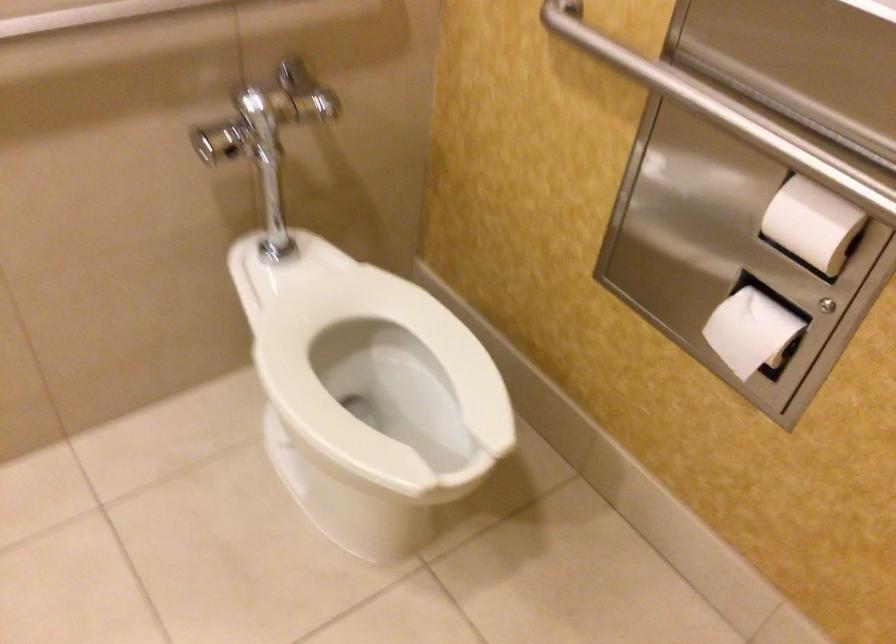
Question: The images are taken continuously from a first-person perspective. In which direction is your viewpoint rotating?

Choices:
 (A) Left
 (B) Right
 (C) Up
 (D) Down

Answer: (A)